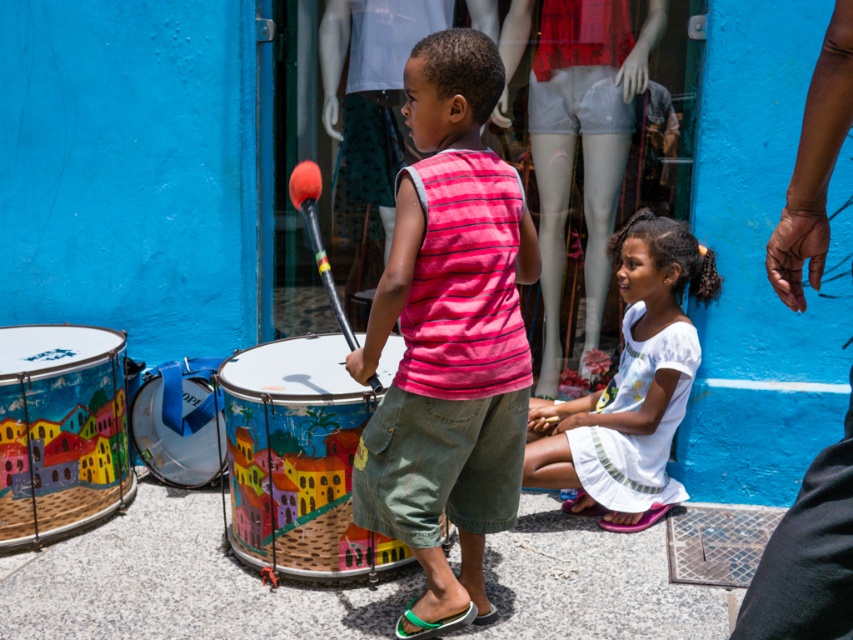
You are a street performer who wants to choose the bigger drum to play. Which painted wooden drum should you pick between the painted wooden drum at center and the painted wooden drum at lower left?

The painted wooden drum at center has a larger size compared to the painted wooden drum at lower left, so you should choose the painted wooden drum at center.